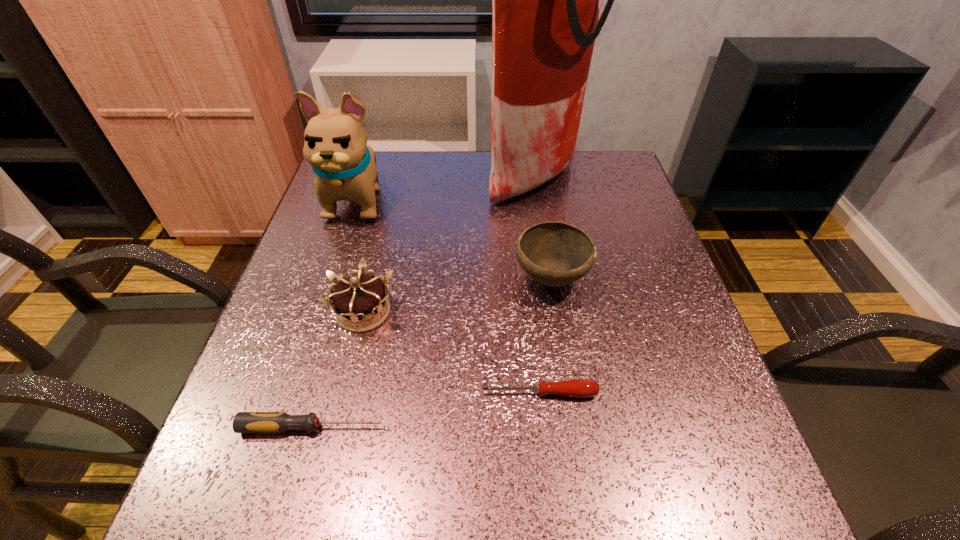
The image size is (960, 540). What are the coordinates of `free space located 0.130m on the right of the crown` in the screenshot? It's located at (459, 312).

Where is `vacant area situated on the front of the bowl`? vacant area situated on the front of the bowl is located at coordinates (563, 356).

Identify the location of free location located insert the nearest object into a screw head. (516, 427).

Locate an element on the screen. This screenshot has width=960, height=540. free location located 0.050m on the left of the second nearest object is located at coordinates (452, 393).

Find the location of `grocery bag present at the far edge`. grocery bag present at the far edge is located at coordinates (546, 0).

Identify the location of puppy that is positioned at the far edge. Image resolution: width=960 pixels, height=540 pixels. (335, 144).

This screenshot has width=960, height=540. What are the coordinates of `puppy present at the left edge` in the screenshot? It's located at (335, 144).

Locate an element on the screen. The image size is (960, 540). crown present at the left edge is located at coordinates (362, 299).

Find the location of a particular element. screwdriver present at the left edge is located at coordinates (244, 422).

Where is `object present at the right edge`? Image resolution: width=960 pixels, height=540 pixels. object present at the right edge is located at coordinates (546, 0).